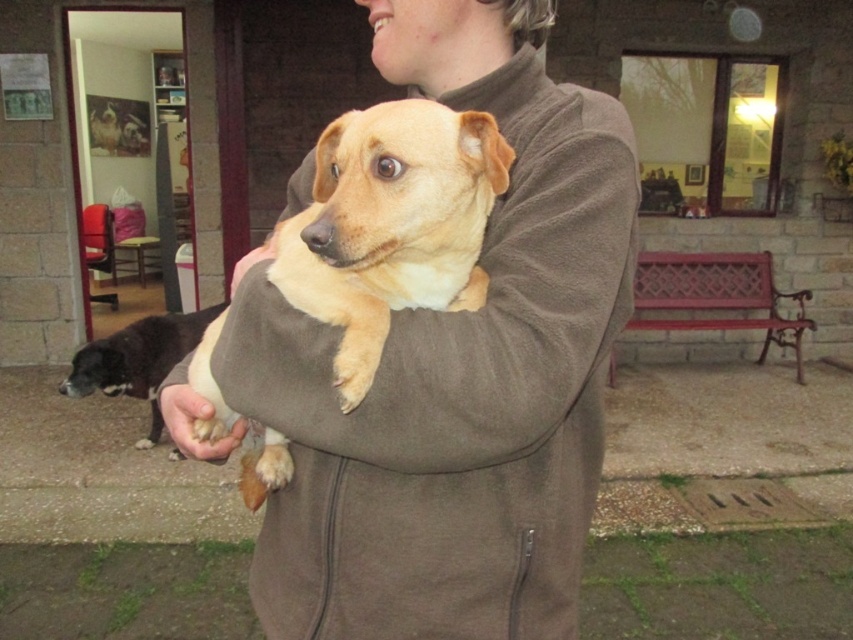
You are a photographer trying to capture the light brown fur at center and the fuzzy beige dog at center in the same frame. Which object should you focus on first to ensure both are in focus?

You should focus on the light brown fur at center first since it is in front of the fuzzy beige dog at center, so adjusting focus starting from the closer object will help both be in focus.